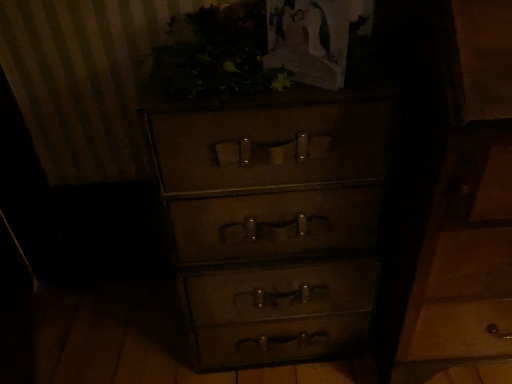
Question: From the image's perspective, is green leafy plant at upper center positioned above or below matte brown chest of drawers at center?

Choices:
 (A) above
 (B) below

Answer: (A)

Question: Considering the positions of green leafy plant at upper center and matte brown chest of drawers at center in the image, is green leafy plant at upper center taller or shorter than matte brown chest of drawers at center?

Choices:
 (A) short
 (B) tall

Answer: (A)

Question: Is green leafy plant at upper center spatially inside matte brown chest of drawers at center, or outside of it?

Choices:
 (A) outside
 (B) inside

Answer: (A)

Question: In terms of width, does matte brown chest of drawers at center look wider or thinner when compared to green leafy plant at upper center?

Choices:
 (A) wide
 (B) thin

Answer: (A)

Question: Considering the relative positions of matte brown chest of drawers at center and green leafy plant at upper center in the image provided, is matte brown chest of drawers at center to the left or to the right of green leafy plant at upper center?

Choices:
 (A) right
 (B) left

Answer: (A)

Question: Is matte brown chest of drawers at center in front of or behind green leafy plant at upper center in the image?

Choices:
 (A) behind
 (B) front

Answer: (A)

Question: Would you say matte brown chest of drawers at center is inside or outside green leafy plant at upper center?

Choices:
 (A) outside
 (B) inside

Answer: (A)